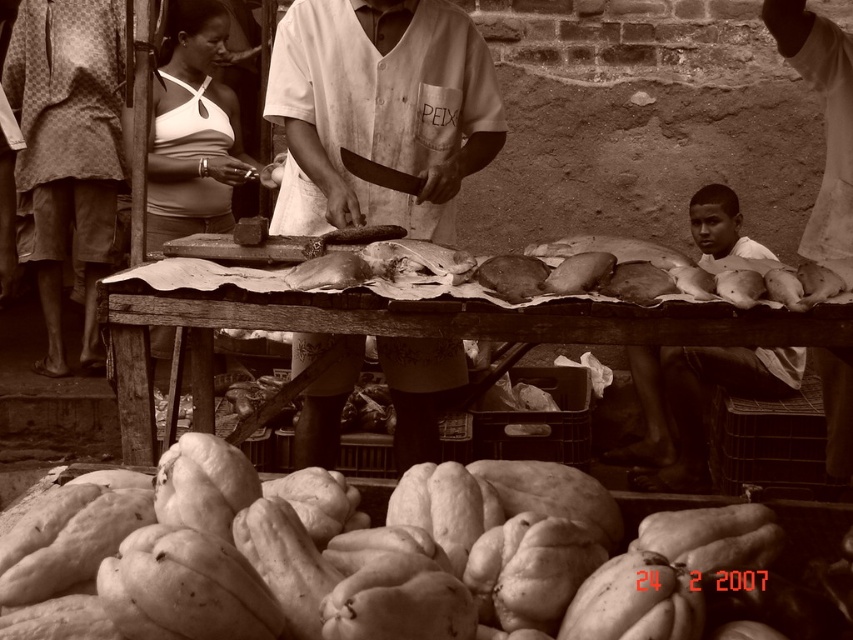
Is point (608, 620) more distant than point (686, 417)?

That is False.

Describe the element at coordinates (376, 561) in the screenshot. The width and height of the screenshot is (853, 640). I see `rough textured squash at lower center` at that location.

Identify the location of rough textured squash at lower center. coord(376,561).

Who is lower down, white fabric shirt at center or patterned fabric shorts at left?

white fabric shirt at center

From the picture: Who is positioned more to the left, white fabric shirt at center or patterned fabric shorts at left?

From the viewer's perspective, patterned fabric shorts at left appears more on the left side.

Between point (415, 419) and point (44, 273), which one is positioned in front?

Point (415, 419) is in front.

Locate an element on the screen. The width and height of the screenshot is (853, 640). white fabric shirt at center is located at coordinates (379, 109).

From the picture: Can you confirm if white fabric shirt at center is positioned to the right of smooth white blouse at upper left?

Indeed, white fabric shirt at center is positioned on the right side of smooth white blouse at upper left.

Consider the image. Does white fabric shirt at center have a greater height compared to smooth white blouse at upper left?

In fact, white fabric shirt at center may be shorter than smooth white blouse at upper left.

Which is in front, point (395, 76) or point (201, 38)?

Point (395, 76) is more forward.

Where is `white fabric shirt at center`? white fabric shirt at center is located at coordinates (379, 109).